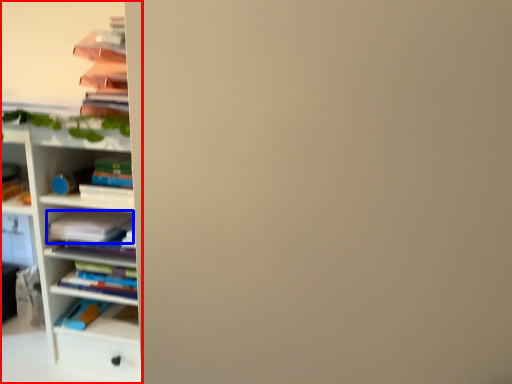
Question: Which object is further to the camera taking this photo, shelf (highlighted by a red box) or book (highlighted by a blue box)?

Choices:
 (A) shelf
 (B) book

Answer: (B)